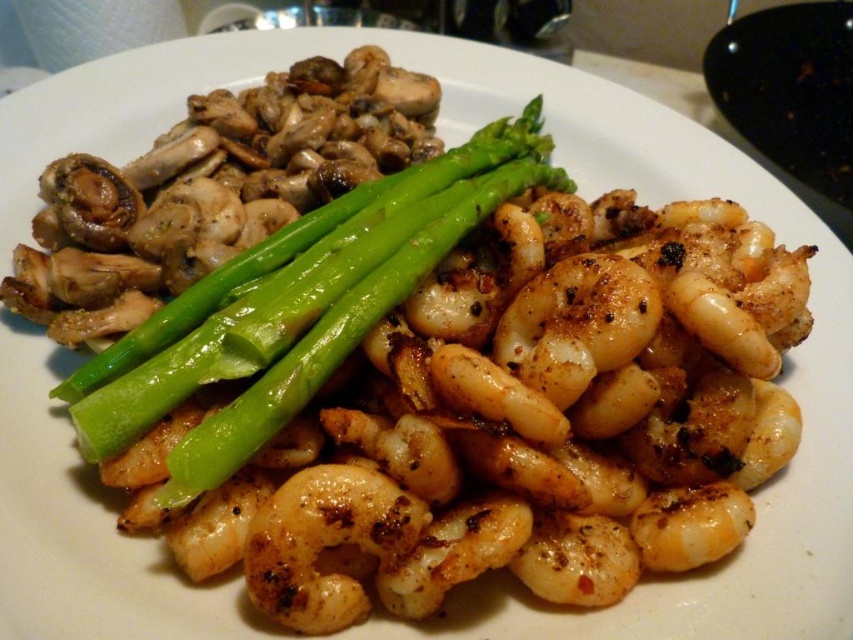
Question: Does green glossy asparagus at center appear under glossy white shrimp at center?

Choices:
 (A) no
 (B) yes

Answer: (A)

Question: Can you confirm if green glossy asparagus at center is positioned to the left of glossy white shrimp at center?

Choices:
 (A) no
 (B) yes

Answer: (B)

Question: Which object is closer to the camera taking this photo?

Choices:
 (A) green glossy asparagus at center
 (B) glossy white shrimp at center

Answer: (A)

Question: Is the position of green glossy asparagus at center more distant than that of glossy white shrimp at center?

Choices:
 (A) no
 (B) yes

Answer: (A)

Question: Among these objects, which one is farthest from the camera?

Choices:
 (A) glossy white shrimp at center
 (B) green glossy asparagus at center

Answer: (A)